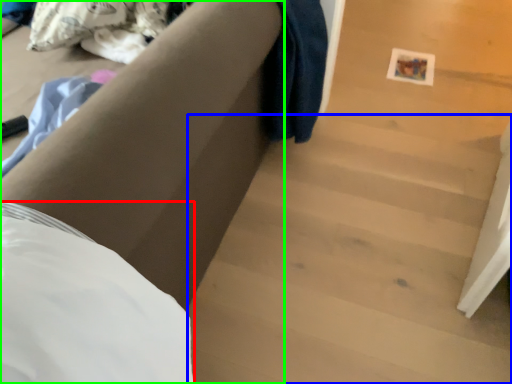
Question: Considering the real-world distances, which object is closest to sheet (highlighted by a red box)? stairwell (highlighted by a blue box) or furniture (highlighted by a green box).

Choices:
 (A) stairwell
 (B) furniture

Answer: (B)